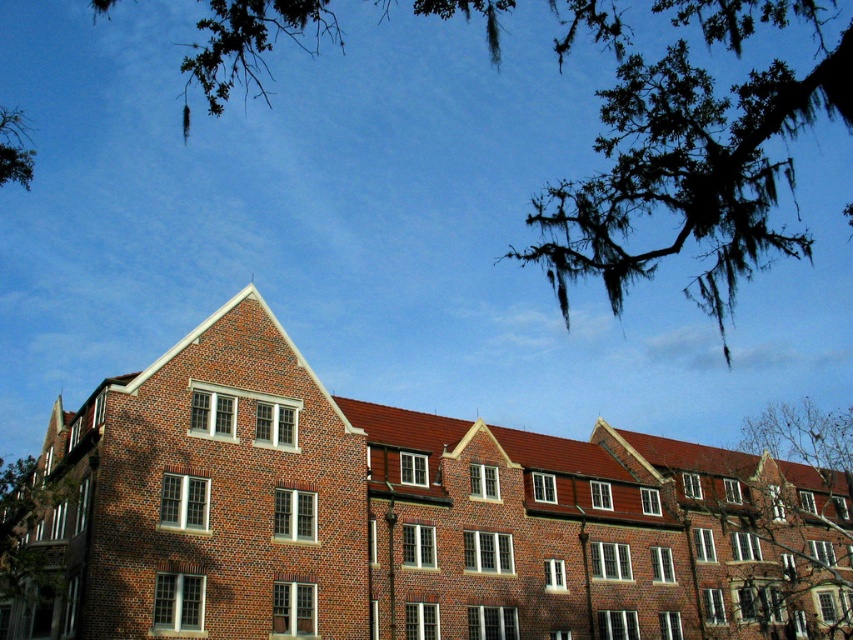
Question: Among these points, which one is nearest to the camera?

Choices:
 (A) (689, 188)
 (B) (30, 179)

Answer: (A)

Question: Which of these objects is positioned farthest from the green mossy tree at lower left?

Choices:
 (A) green mossy branches at upper center
 (B) red brick building at center
 (C) green mossy branch at upper right

Answer: (A)

Question: Does green mossy tree at lower left appear on the left side of green mossy branch at upper left?

Choices:
 (A) yes
 (B) no

Answer: (B)

Question: Is green mossy tree at lower left in front of green mossy branch at upper left?

Choices:
 (A) no
 (B) yes

Answer: (A)

Question: Among these objects, which one is farthest from the camera?

Choices:
 (A) green mossy branch at upper left
 (B) green mossy branches at upper center
 (C) red brick building at center
 (D) green mossy branch at upper right

Answer: (D)

Question: Can you confirm if green mossy branch at upper right is positioned below green mossy tree at lower left?

Choices:
 (A) no
 (B) yes

Answer: (A)